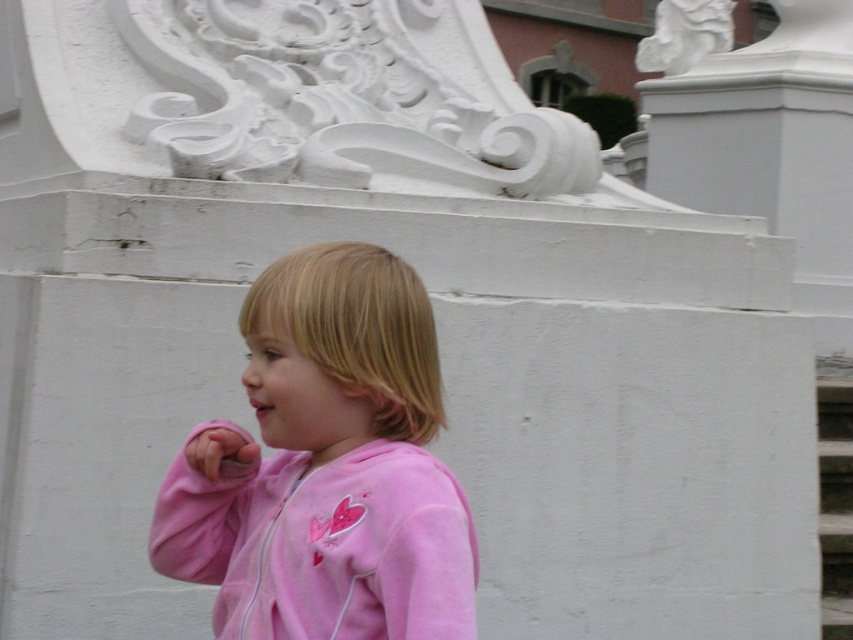
You are a photographer standing 15 feet away from the child in the image. You want to take a photo of the pink fleece jacket at center. Is the jacket within your camera range if your camera can focus up to 16 feet?

The pink fleece jacket at center is 16.18 feet away from the viewer. Since the camera can focus up to 16 feet, the jacket is slightly out of range and cannot be focused clearly.

You are a photographer setting up a shot of the pink fleece jacket at center and the white textured stair at lower right. You want to ensure the jacket is in focus while the stair is slightly blurred. Which part of the image should you focus on to achieve this effect?

You should focus on the pink fleece jacket at center because it is located above the white textured stair at lower right, so focusing on the jacket will keep it sharp while the stair, being further away, becomes slightly blurred.